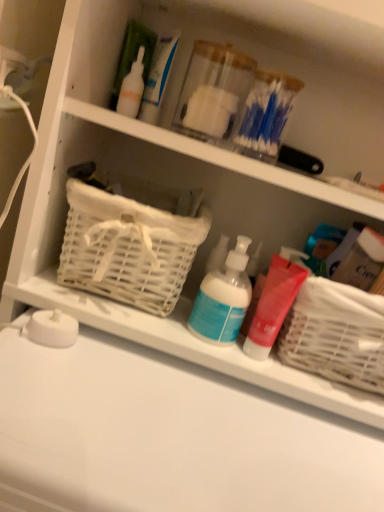
Question: Does blue matte pump bottle at center, positioned as the second cleaning product in right-to-left order, have a greater width compared to white matte counter top at lower center?

Choices:
 (A) no
 (B) yes

Answer: (A)

Question: Are blue matte pump bottle at center, marked as the first cleaning product in a left-to-right arrangement, and white matte counter top at lower center far apart?

Choices:
 (A) yes
 (B) no

Answer: (B)

Question: Is blue matte pump bottle at center, marked as the first cleaning product in a left-to-right arrangement, thinner than white matte counter top at lower center?

Choices:
 (A) no
 (B) yes

Answer: (B)

Question: From the image's perspective, is blue matte pump bottle at center, positioned as the second cleaning product in right-to-left order, located above white matte counter top at lower center?

Choices:
 (A) yes
 (B) no

Answer: (A)

Question: Is blue matte pump bottle at center, positioned as the second cleaning product in right-to-left order, facing towards white matte counter top at lower center?

Choices:
 (A) no
 (B) yes

Answer: (A)

Question: From a real-world perspective, is blue matte pump bottle at center, marked as the first cleaning product in a left-to-right arrangement, below white matte counter top at lower center?

Choices:
 (A) no
 (B) yes

Answer: (A)

Question: Can you confirm if white matte counter top at lower center is positioned to the left of matte red pump bottle at center, which ranks as the 1th cleaning product in right-to-left order?

Choices:
 (A) no
 (B) yes

Answer: (B)

Question: Considering the relative sizes of white matte counter top at lower center and matte red pump bottle at center, which ranks as the 1th cleaning product in right-to-left order, in the image provided, is white matte counter top at lower center bigger than matte red pump bottle at center, which ranks as the 1th cleaning product in right-to-left order,?

Choices:
 (A) yes
 (B) no

Answer: (A)

Question: Can you confirm if white matte counter top at lower center is taller than matte red pump bottle at center, which ranks as the 1th cleaning product in right-to-left order?

Choices:
 (A) yes
 (B) no

Answer: (A)

Question: From the image's perspective, is white matte counter top at lower center beneath matte red pump bottle at center, which ranks as the 1th cleaning product in right-to-left order?

Choices:
 (A) no
 (B) yes

Answer: (B)

Question: Is white matte counter top at lower center thinner than matte red pump bottle at center, which ranks as the 1th cleaning product in right-to-left order?

Choices:
 (A) no
 (B) yes

Answer: (A)

Question: Is white matte counter top at lower center smaller than matte red pump bottle at center, which ranks as the 1th cleaning product in right-to-left order?

Choices:
 (A) no
 (B) yes

Answer: (A)

Question: Is white wicker basket at left, which ranks as the first basket in left-to-right order, outside of blue matte pump bottle at center, marked as the first cleaning product in a left-to-right arrangement?

Choices:
 (A) no
 (B) yes

Answer: (B)